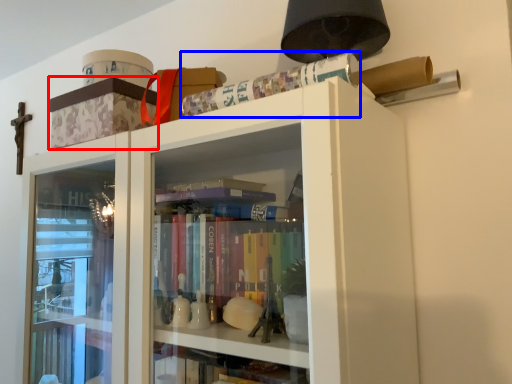
Question: Which of the following is the farthest to the observer, cabinetry (highlighted by a red box) or paperback book (highlighted by a blue box)?

Choices:
 (A) cabinetry
 (B) paperback book

Answer: (A)